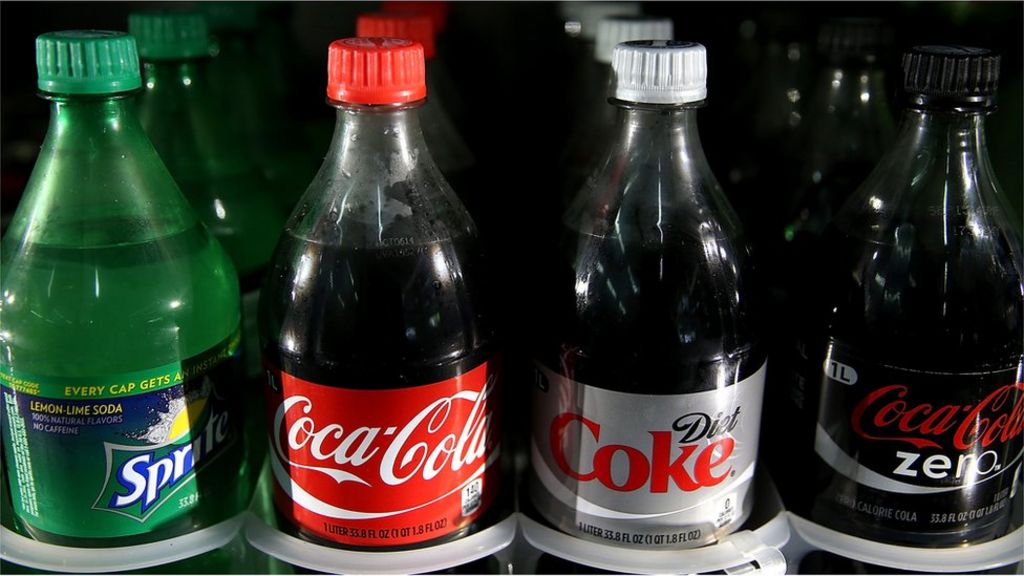
The height and width of the screenshot is (576, 1024). I want to click on bottles in the first row, so click(139, 439), click(345, 443), click(644, 439), click(932, 420).